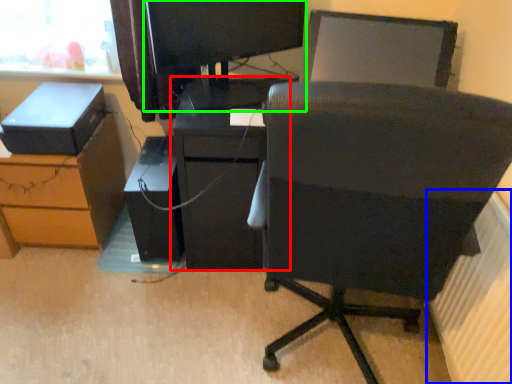
Question: Which object is the closest to the furniture (highlighted by a red box)? Choose among these: radiator (highlighted by a blue box) or desktop computer (highlighted by a green box).

Choices:
 (A) radiator
 (B) desktop computer

Answer: (B)